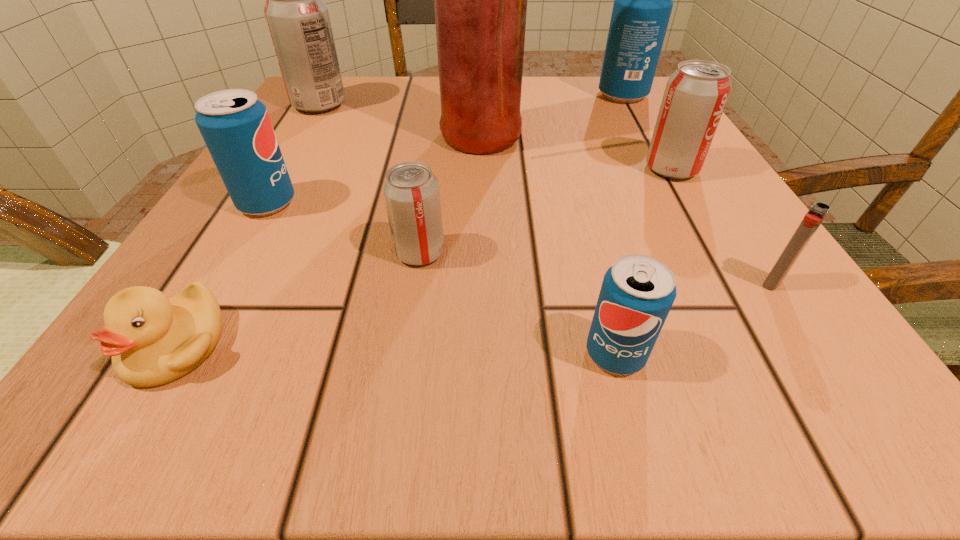
Locate an element on the screen. red fire extinguisher is located at coordinates (480, 0).

Identify the location of fire extinguisher. The width and height of the screenshot is (960, 540). (480, 0).

Locate an element on the screen. This screenshot has width=960, height=540. the farthest blue soda can is located at coordinates (643, 0).

The width and height of the screenshot is (960, 540). Identify the location of the rightmost blue soda can. (643, 0).

You are a GUI agent. You are given a task and a screenshot of the screen. Output one action in this format:
    pyautogui.click(x=<x>, y=<y>)
    Task: Click on the leftmost gray soda can
    The image size is (960, 540).
    Given the screenshot: What is the action you would take?
    pyautogui.click(x=298, y=20)

Where is `the biggest gray soda can`? The width and height of the screenshot is (960, 540). the biggest gray soda can is located at coordinates (298, 20).

Identify the location of the second nearest gray soda can. The width and height of the screenshot is (960, 540). (695, 96).

Where is `the second biggest gray soda can`? the second biggest gray soda can is located at coordinates (695, 96).

Identify the location of the third nearest soda can. (236, 128).

Identify the location of the second smallest blue soda can. The image size is (960, 540). (236, 128).